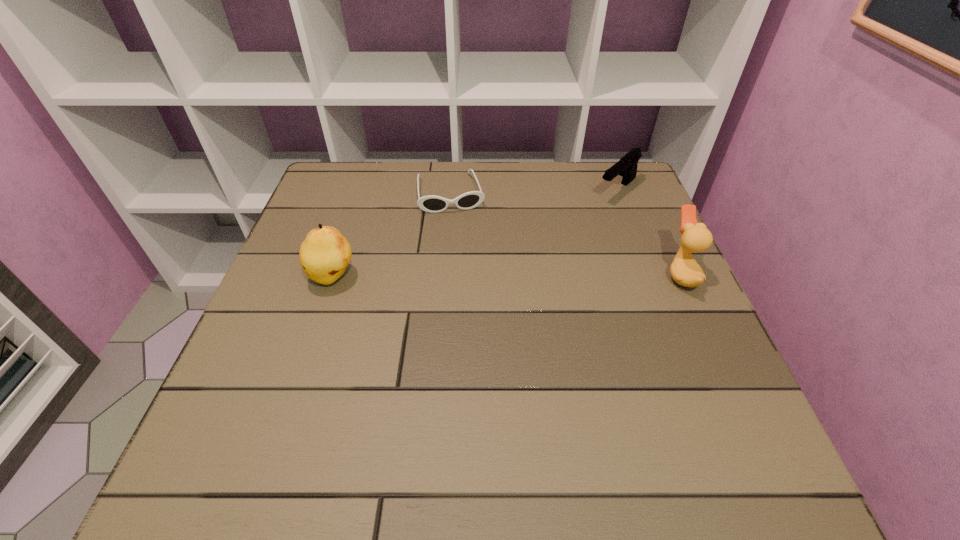
I want to click on the leftmost object, so (x=325, y=253).

At what (x,y) coordinates should I click in order to perform the action: click on duck. Please return your answer as a coordinate pair (x, y). The image size is (960, 540). Looking at the image, I should click on (684, 270).

Where is `the third tallest object`? The height and width of the screenshot is (540, 960). the third tallest object is located at coordinates (626, 167).

This screenshot has width=960, height=540. What are the coordinates of `the third object from right to left` in the screenshot? It's located at (433, 204).

Where is `sunglasses`? sunglasses is located at coordinates (433, 204).

Find the location of a particular element. This screenshot has height=540, width=960. vacant space situated 0.350m on the back of the pear is located at coordinates (366, 177).

Locate an element on the screen. vacant region located 0.200m on the beak of the duck is located at coordinates (575, 274).

I want to click on vacant area situated on the beak of the duck, so click(642, 274).

What are the coordinates of `free point located on the beak of the duck` in the screenshot? It's located at (570, 274).

The image size is (960, 540). Find the location of `free space located 0.300m on the front-facing side of the third tallest object`. free space located 0.300m on the front-facing side of the third tallest object is located at coordinates (538, 260).